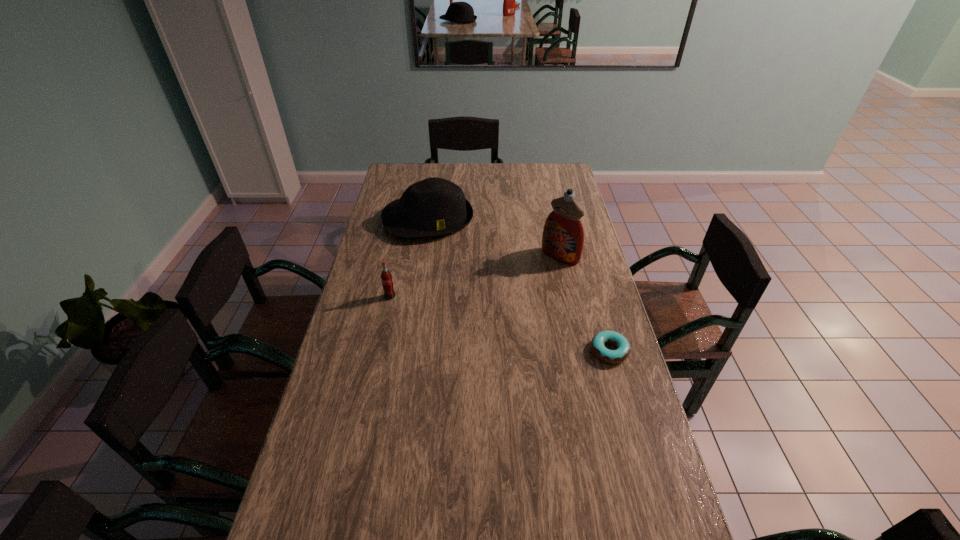
Find the location of a particular element. the second nearest object is located at coordinates (386, 277).

Locate an element on the screen. The image size is (960, 540). doughnut is located at coordinates (622, 352).

Where is `the nearest object`? The width and height of the screenshot is (960, 540). the nearest object is located at coordinates (622, 352).

Identify the location of the tallest object. (563, 236).

I want to click on detergent, so click(563, 236).

Locate an element on the screen. This screenshot has width=960, height=540. the farthest object is located at coordinates (434, 206).

Identify the location of vacant area situated 0.190m on the label of the soda bottle. (380, 342).

What are the coordinates of `free space located on the back of the nearest object` in the screenshot? It's located at point(585,260).

Find the location of a particular element. vacant region located on the front surface of the detergent is located at coordinates (506, 307).

Identify the location of vacant position located 0.050m on the front surface of the detergent. (543, 271).